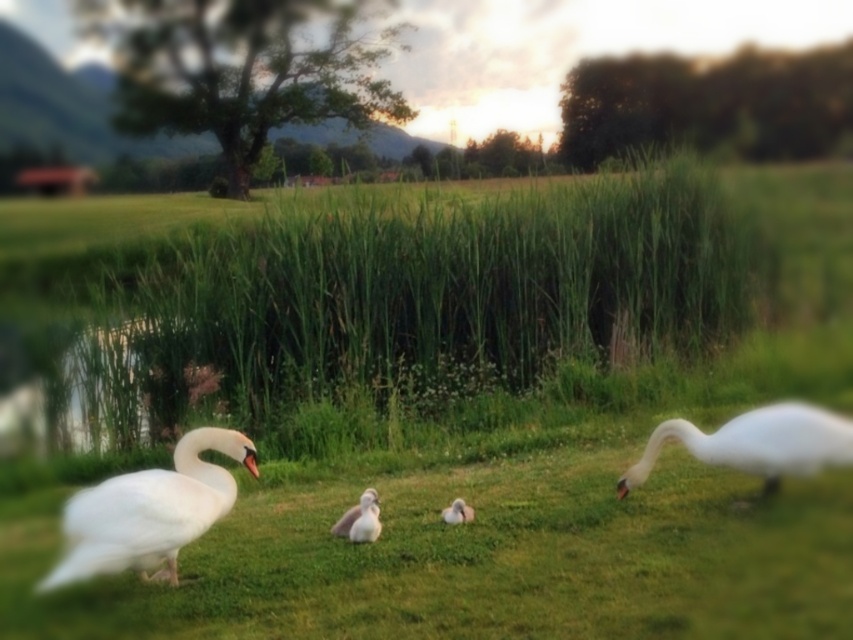
Is white glossy swan at right taller than white feathered goose at center?

Yes, white glossy swan at right is taller than white feathered goose at center.

Who is higher up, white glossy swan at right or white feathered goose at center?

white glossy swan at right is higher up.

Is point (763, 436) positioned after point (355, 528)?

No, (763, 436) is closer to viewer.

Image resolution: width=853 pixels, height=640 pixels. I want to click on white glossy swan at right, so click(x=756, y=444).

Does white glossy swan at left appear over white smooth duckling at center?

Indeed, white glossy swan at left is positioned over white smooth duckling at center.

Describe the element at coordinates (149, 512) in the screenshot. The height and width of the screenshot is (640, 853). I see `white glossy swan at left` at that location.

Who is more distant from viewer, (x=107, y=481) or (x=341, y=532)?

The point (x=341, y=532) is behind.

At what (x,y) coordinates should I click in order to perform the action: click on white glossy swan at left. Please return your answer as a coordinate pair (x, y). Image resolution: width=853 pixels, height=640 pixels. Looking at the image, I should click on (149, 512).

Is white glossy swan at right to the right of white fluffy duckling at center from the viewer's perspective?

Yes, white glossy swan at right is to the right of white fluffy duckling at center.

This screenshot has height=640, width=853. What do you see at coordinates (756, 444) in the screenshot?
I see `white glossy swan at right` at bounding box center [756, 444].

Who is more distant from viewer, (682,435) or (456,522)?

The point (456,522) is behind.

You are a GUI agent. You are given a task and a screenshot of the screen. Output one action in this format:
    pyautogui.click(x=<x>, y=<y>)
    Task: Click on the white glossy swan at right
    This screenshot has height=640, width=853.
    Given the screenshot: What is the action you would take?
    pyautogui.click(x=756, y=444)